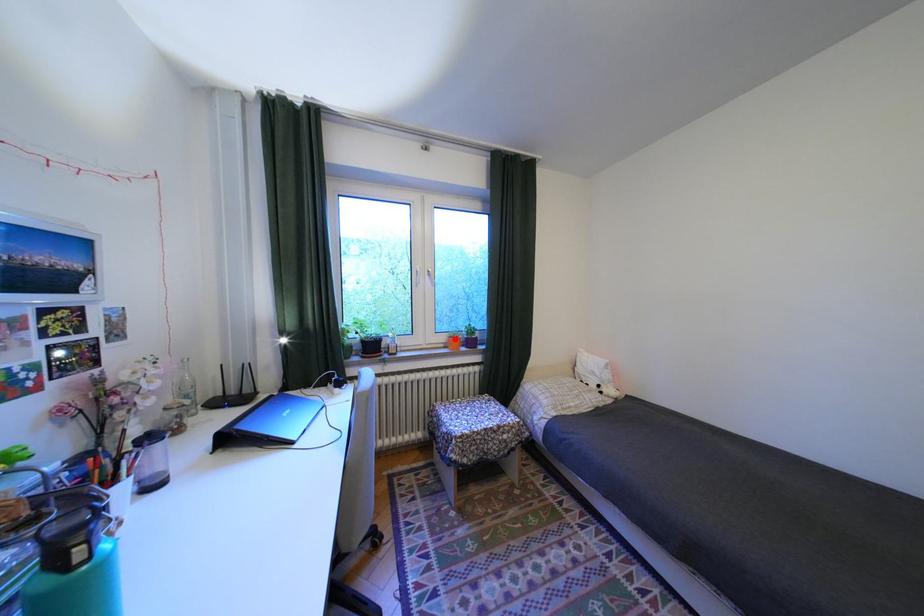
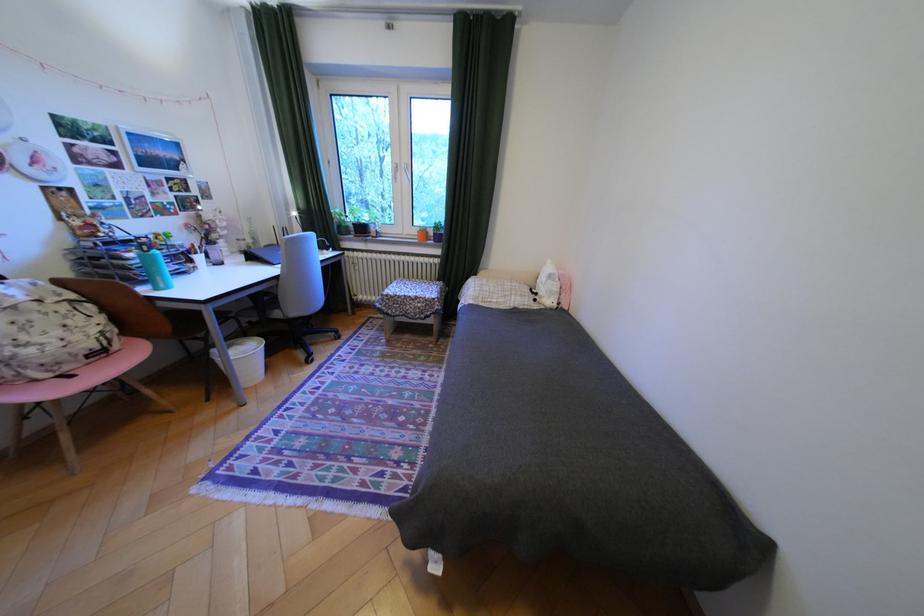
Question: I am providing you with two images of the same scene from different viewpoints. In image1, a red point is highlighted. Considering the same 3D point in image2, which of the following is correct?

Choices:
 (A) It is closer
 (B) It is farther

Answer: (A)